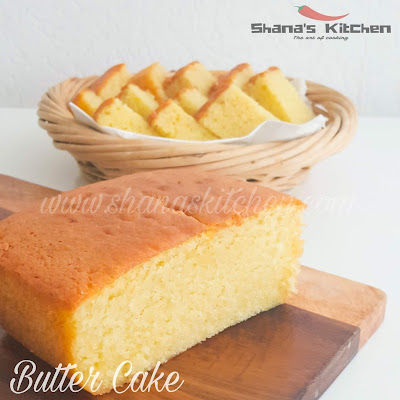
Where is `circular wooden bowl`? The image size is (400, 400). circular wooden bowl is located at coordinates (126, 152).